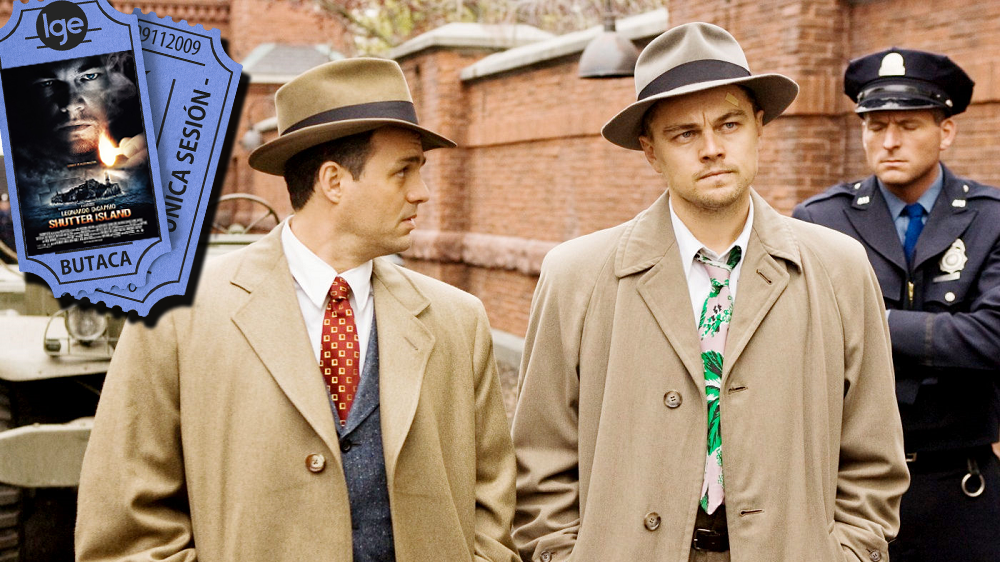
You are a GUI agent. You are given a task and a screenshot of the screen. Output one action in this format:
    pyautogui.click(x=<x>, y=<y>)
    Task: Click on the hanging lamp
    This screenshot has width=1000, height=562.
    Given the screenshot: What is the action you would take?
    pyautogui.click(x=612, y=55)